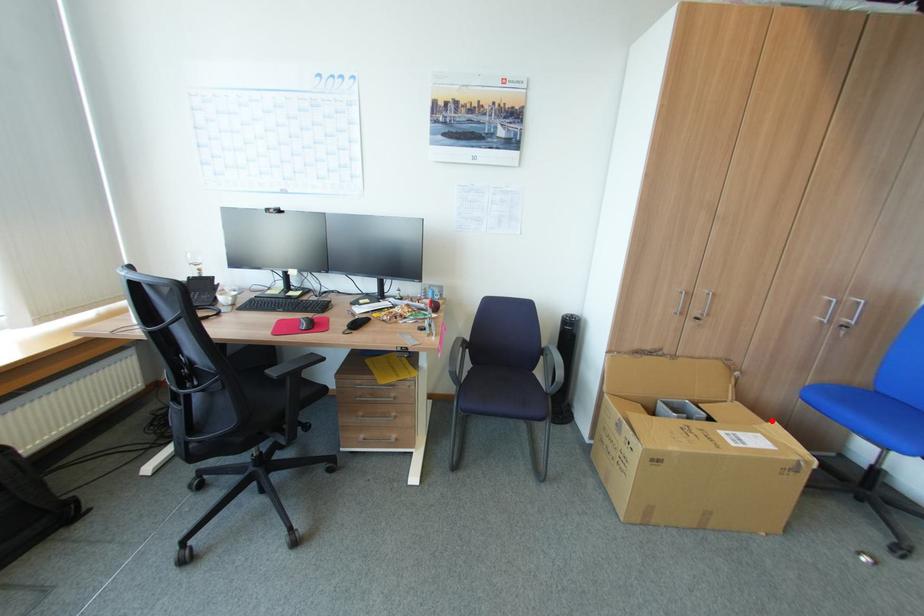
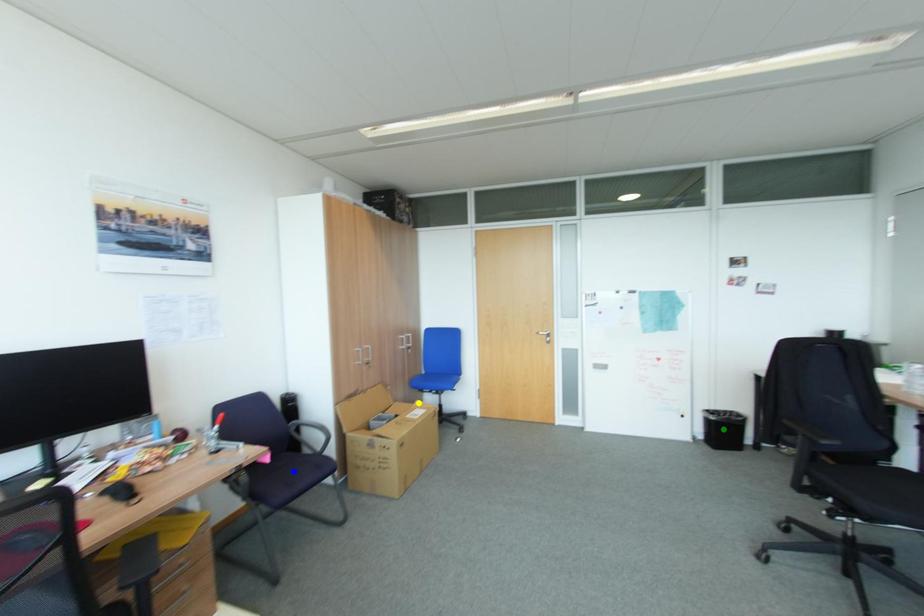
Question: I am providing you with two images of the same scene from different viewpoints. A red point is marked on the first image. You are given multiple points on the second image. In image 2, which mark is for the same physical point as the one in image 1?

Choices:
 (A) blue point
 (B) yellow point
 (C) green point

Answer: (B)